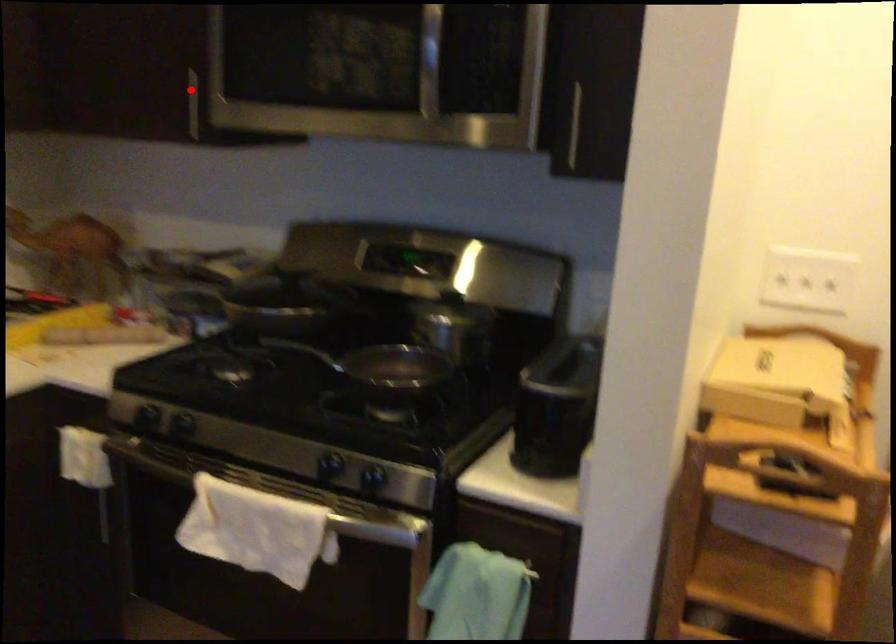
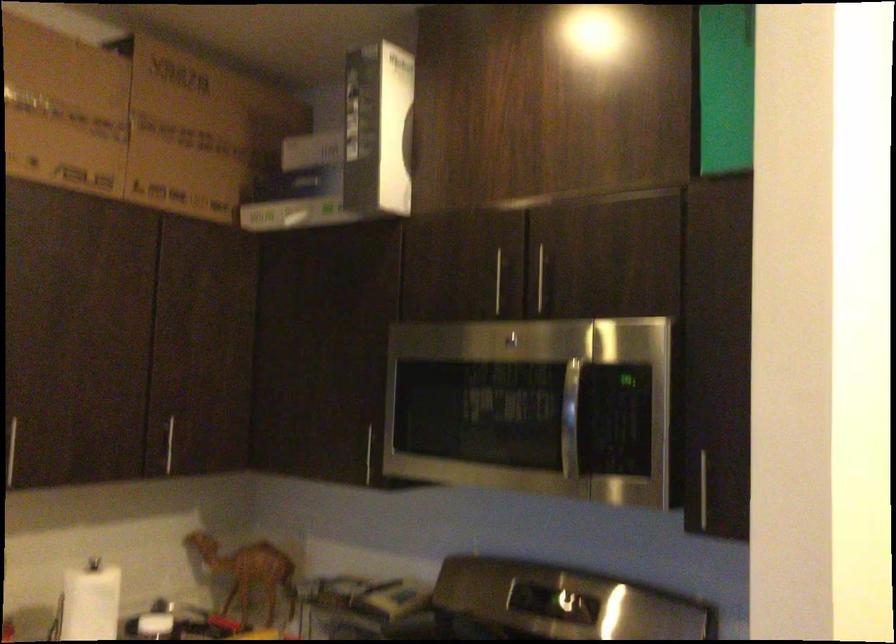
Where in the second image is the point corresponding to the highlighted location from the first image?

(364, 440)